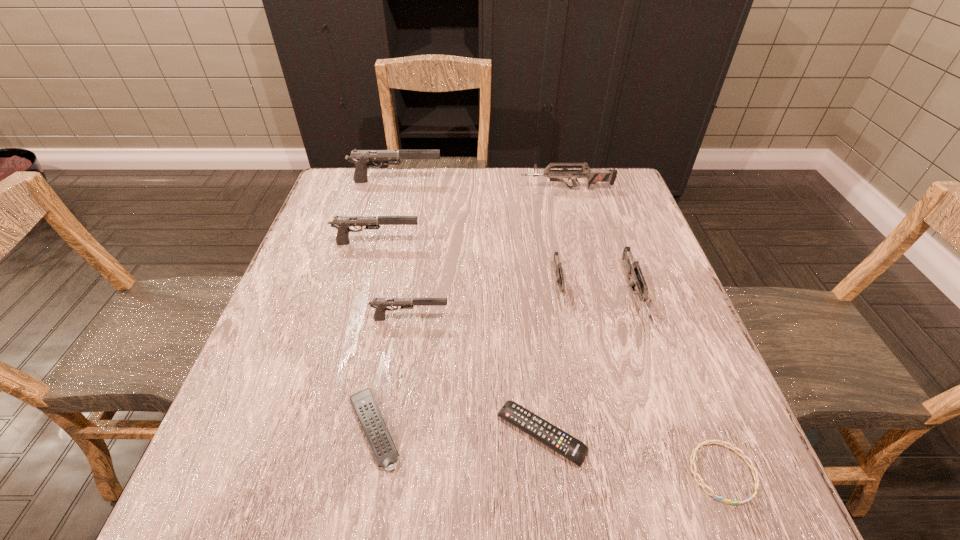
This screenshot has height=540, width=960. What are the coordinates of `vacant area that lies between the bracelet and the fourth nearest gun` in the screenshot? It's located at (549, 357).

Where is `vacant point located between the third farthest object and the fourth shortest object`? This screenshot has height=540, width=960. vacant point located between the third farthest object and the fourth shortest object is located at coordinates (468, 265).

Find the location of a particular element. The height and width of the screenshot is (540, 960). empty location between the farthest grey gun and the black remote control is located at coordinates (554, 312).

Identify the location of blank region between the nearest gray gun and the fourth shortest object. Image resolution: width=960 pixels, height=540 pixels. (485, 303).

The width and height of the screenshot is (960, 540). Find the location of `free point between the smallest gray gun and the third farthest gun`. free point between the smallest gray gun and the third farthest gun is located at coordinates (393, 281).

Locate an element on the screen. object identified as the closest to the left remote control is located at coordinates (556, 439).

Point out which object is positioned as the seventh nearest to the bracelet. Please provide its 2D coordinates. Your answer should be formatted as a tuple, i.e. [(x, y)], where the tuple contains the x and y coordinates of a point satisfying the conditions above.

[(593, 176)]

Identify which gun is the second nearest to the right remote control. Please provide its 2D coordinates. Your answer should be formatted as a tuple, i.e. [(x, y)], where the tuple contains the x and y coordinates of a point satisfying the conditions above.

[(380, 304)]

Point out which gun is positioned as the fifth nearest to the smallest grey gun. Please provide its 2D coordinates. Your answer should be formatted as a tuple, i.e. [(x, y)], where the tuple contains the x and y coordinates of a point satisfying the conditions above.

[(361, 158)]

Locate which gray gun ranks in proximity to the nearest gray gun. Please provide its 2D coordinates. Your answer should be formatted as a tuple, i.e. [(x, y)], where the tuple contains the x and y coordinates of a point satisfying the conditions above.

[(342, 223)]